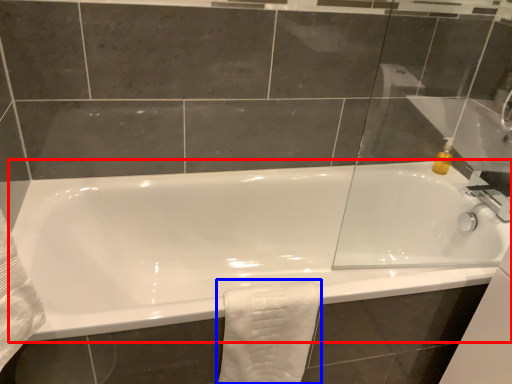
Question: Which object appears closest to the camera in this image, bathtub (highlighted by a red box) or bath towel (highlighted by a blue box)?

Choices:
 (A) bathtub
 (B) bath towel

Answer: (A)